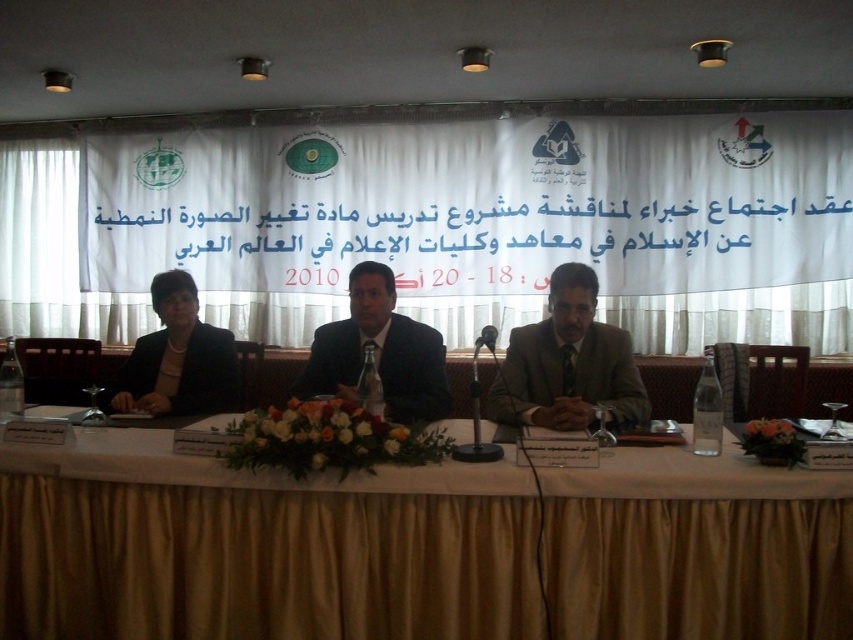
Which is above, white fabric table at center or dark blue suit at center?

dark blue suit at center is above.

Does point (277, 586) come in front of point (442, 385)?

That is True.

The height and width of the screenshot is (640, 853). I want to click on white fabric table at center, so click(x=258, y=547).

Is matte brown suit at center positioned behind black matte suit at left?

No, matte brown suit at center is closer to the viewer.

Is matte brown suit at center bigger than black matte suit at left?

Yes.

Does point (550, 342) lie in front of point (194, 406)?

Yes.

Locate an element on the screen. matte brown suit at center is located at coordinates (567, 376).

Does matte brown suit at center have a lesser height compared to dark blue suit at center?

Yes.

Is matte brown suit at center below dark blue suit at center?

Yes.

Where is `matte brown suit at center`? Image resolution: width=853 pixels, height=640 pixels. matte brown suit at center is located at coordinates (567, 376).